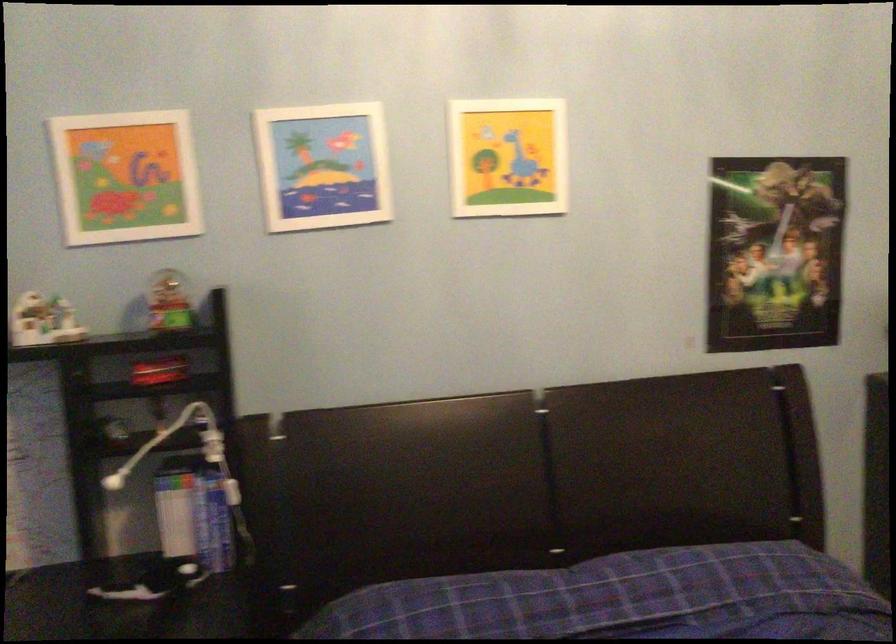
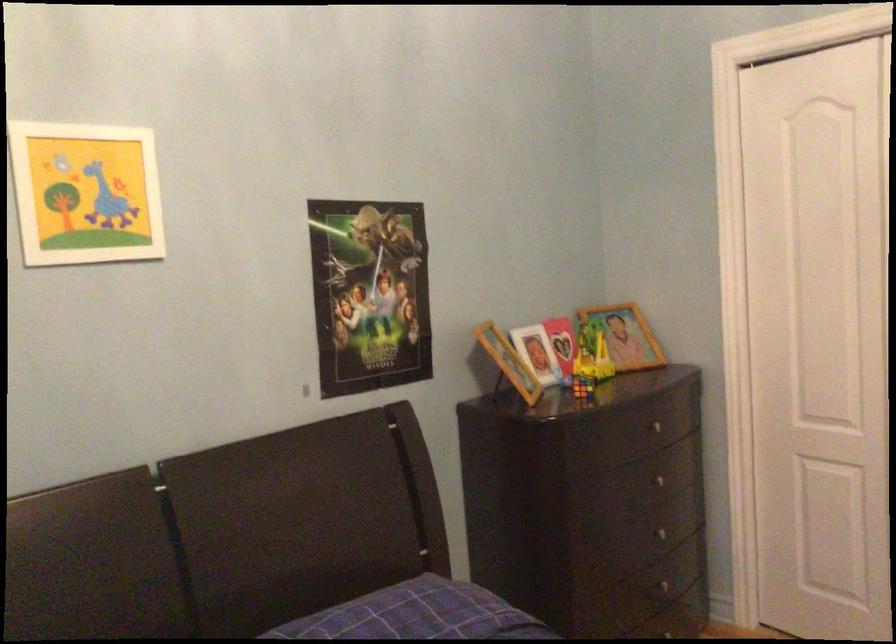
Find the pixel in the second image that matches the point at 510,156 in the first image.

(85, 193)